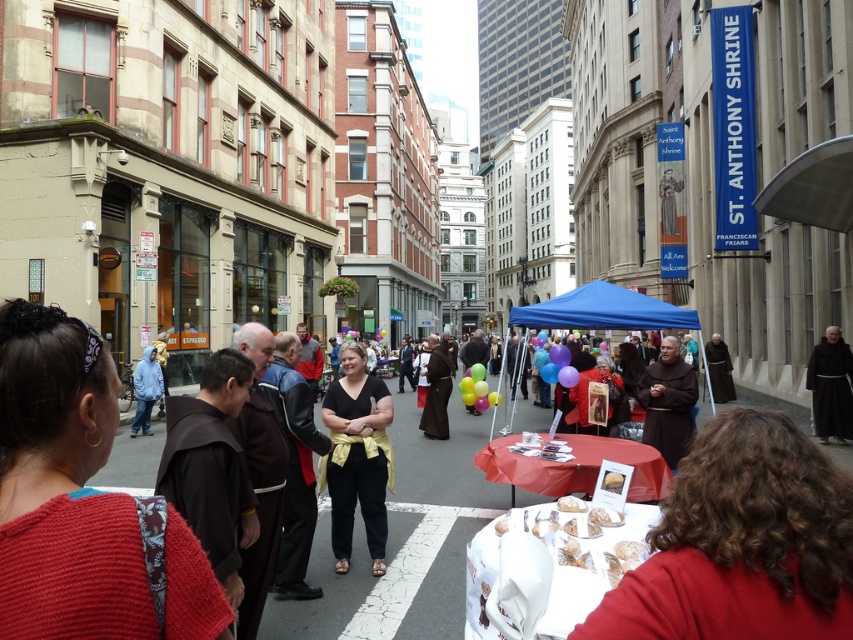
You are a photographer standing at the corner of the street. You want to take a photo of the black matte shirt at center. Where should you position yourself to capture it in the frame?

To capture the black matte shirt at center in the frame, position yourself so that your camera is aligned with its 2D coordinates at point 0.714 on the x axis and 0.420 on the y axis.

You are a food vendor at the event and want to place a new sign on the table where the white sugared donuts at lower center are displayed. The sign is 12 inches wide. Can the blue fabric canopy at center accommodate the sign without overlapping the donuts?

The white sugared donuts at lower center has a lesser width compared to blue fabric canopy at center, meaning the canopy is wider. Since the sign is 12 inches wide, it should fit under the canopy without overlapping the donuts as long as it is placed appropriately.

Consider the image. You are a vendor at the event and need to place a new item on the table. The item requires a space larger than the black matte shirt at center. Is there enough space next to the white sugared donuts at lower center?

The black matte shirt at center has a larger size compared to white sugared donuts at lower center. Since the item needs a space larger than the black matte shirt at center, the space next to the white sugared donuts at lower center may not be sufficient as it is smaller.